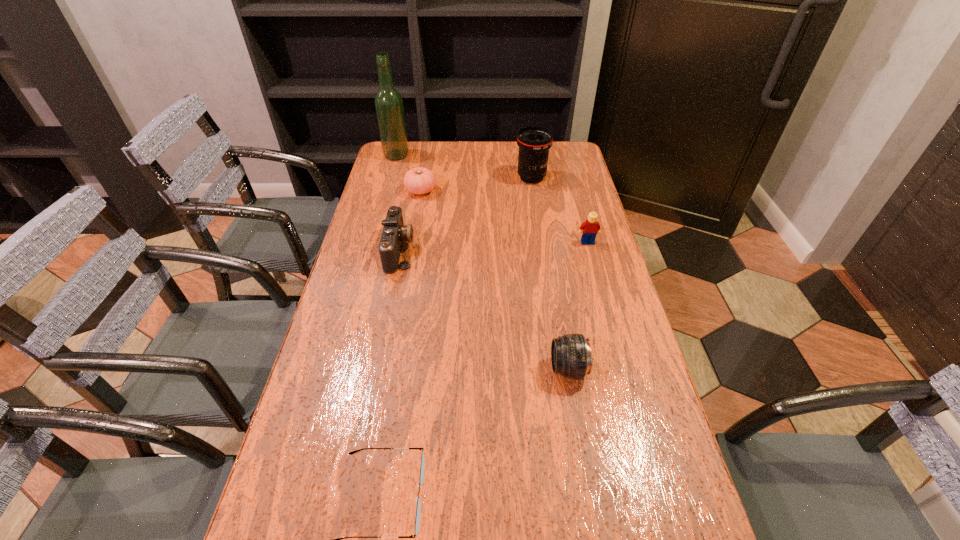
Image resolution: width=960 pixels, height=540 pixels. Find the location of `vacant area between the rightmost object and the taller telephoto lens`. vacant area between the rightmost object and the taller telephoto lens is located at coordinates (560, 210).

Identify the location of free point between the farther telephoto lens and the camera. This screenshot has width=960, height=540. (466, 214).

This screenshot has width=960, height=540. I want to click on free space that is in between the Lego and the farther telephoto lens, so click(x=560, y=210).

Image resolution: width=960 pixels, height=540 pixels. Find the location of `unoccupied area between the second shortest object and the nearer telephoto lens`. unoccupied area between the second shortest object and the nearer telephoto lens is located at coordinates (494, 280).

Where is `empty space between the liquor and the camera`? This screenshot has width=960, height=540. empty space between the liquor and the camera is located at coordinates (397, 202).

Where is `free space between the sixth shortest object and the liquor`? The height and width of the screenshot is (540, 960). free space between the sixth shortest object and the liquor is located at coordinates (464, 166).

Identify which object is the sixth closest to the farther telephoto lens. Please provide its 2D coordinates. Your answer should be formatted as a tuple, i.e. [(x, y)], where the tuple contains the x and y coordinates of a point satisfying the conditions above.

[(417, 521)]

The image size is (960, 540). Find the location of `object that is the fifth closest to the sixth tallest object`. object that is the fifth closest to the sixth tallest object is located at coordinates (571, 357).

The width and height of the screenshot is (960, 540). Find the location of `free location that satisfies the following two spatial constraints: 1. on the front-facing side of the rightmost object; 2. on the front-facing side of the camera`. free location that satisfies the following two spatial constraints: 1. on the front-facing side of the rightmost object; 2. on the front-facing side of the camera is located at coordinates (589, 250).